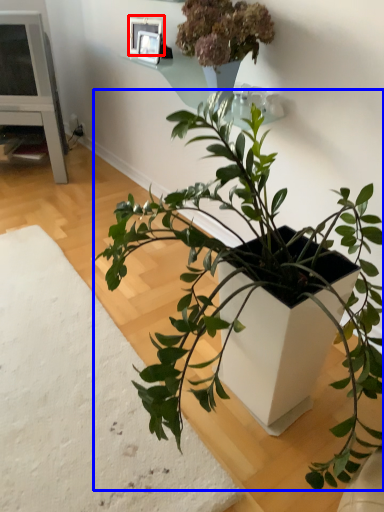
Question: Which object is further to the camera taking this photo, picture frame (highlighted by a red box) or houseplant (highlighted by a blue box)?

Choices:
 (A) picture frame
 (B) houseplant

Answer: (A)